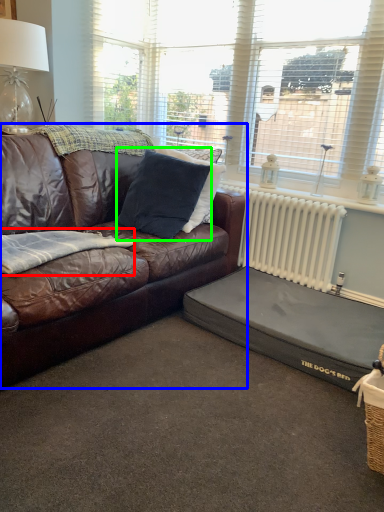
Question: Which is farther away from blanket (highlighted by a red box)? studio couch (highlighted by a blue box) or pillow (highlighted by a green box)?

Choices:
 (A) studio couch
 (B) pillow

Answer: (B)